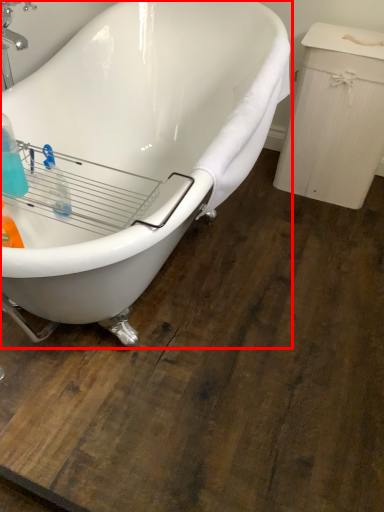
Question: From the image's perspective, what is the correct spatial relationship of bathtub (annotated by the red box) in relation to cleaning product?

Choices:
 (A) above
 (B) below

Answer: (A)